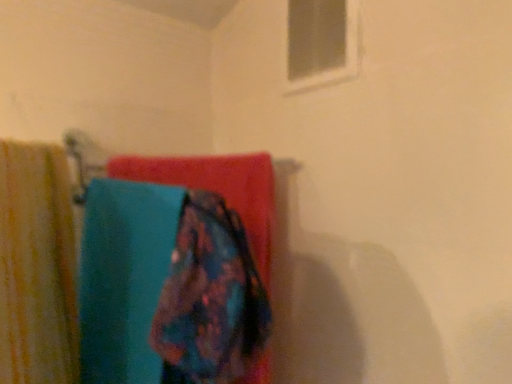
Question: In terms of width, does white plastic window at upper center look wider or thinner when compared to floral fabric towel at center?

Choices:
 (A) wide
 (B) thin

Answer: (B)

Question: Considering their positions, is white plastic window at upper center located in front of or behind floral fabric towel at center?

Choices:
 (A) front
 (B) behind

Answer: (B)

Question: Which object is positioned closest to the floral fabric towel at center?

Choices:
 (A) white plastic window at upper center
 (B) yellow striped fabric at left

Answer: (B)

Question: Based on their relative distances, which object is nearer to the yellow striped fabric at left?

Choices:
 (A) floral fabric towel at center
 (B) white plastic window at upper center

Answer: (A)